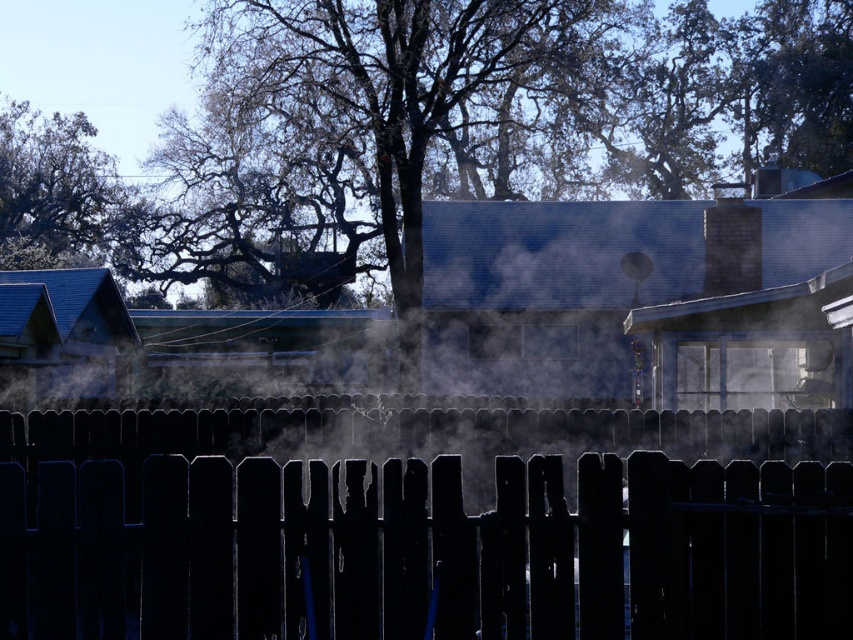
Question: Can you confirm if black wood fence at center is positioned to the right of black brick chimney at upper right?

Choices:
 (A) yes
 (B) no

Answer: (B)

Question: Which point appears farthest from the camera in this image?

Choices:
 (A) (393, 481)
 (B) (746, 262)

Answer: (B)

Question: Where is black wood fence at center located in relation to black brick chimney at upper right in the image?

Choices:
 (A) left
 (B) right

Answer: (A)

Question: Can you confirm if black wood fence at center is wider than black brick chimney at upper right?

Choices:
 (A) no
 (B) yes

Answer: (B)

Question: Which point is farther from the camera taking this photo?

Choices:
 (A) (54, 568)
 (B) (709, 225)

Answer: (B)